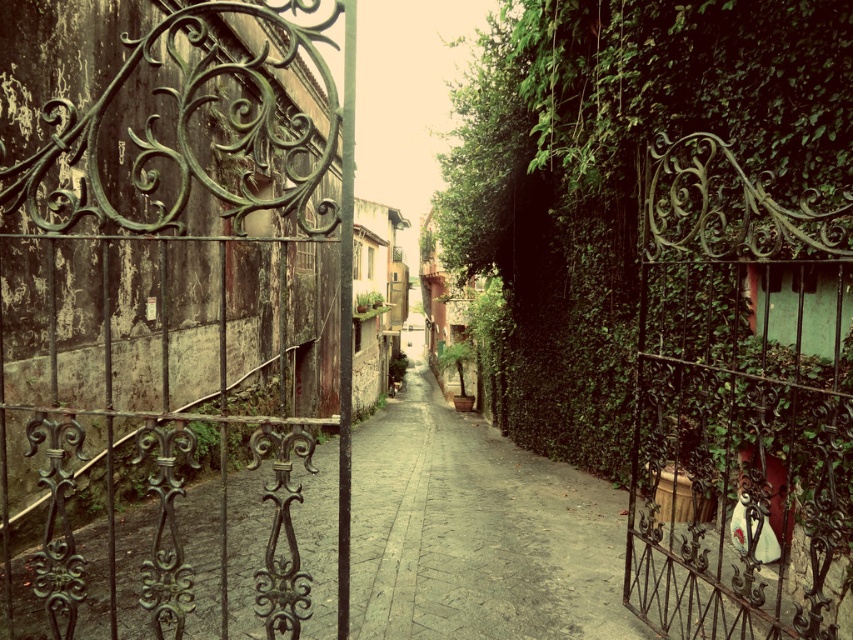
You are a delivery person trying to navigate through the narrow alleyway. You notice the green wrought iron gate at left and the rusty wrought iron gate at center. Which gate should you go through to ensure you have enough space for your delivery cart?

The green wrought iron gate at left is bigger than the rusty wrought iron gate at center, so you should go through the green wrought iron gate at left to have enough space for your delivery cart.

You are a delivery person trying to navigate through the alley. You notice the green wrought iron gate at left and the rusty wrought iron gate at center. Which gate should you pass through if you need to carry a large package that requires more space?

You should pass through the green wrought iron gate at left because its width is larger than the rusty wrought iron gate at center, providing more space for your large package.